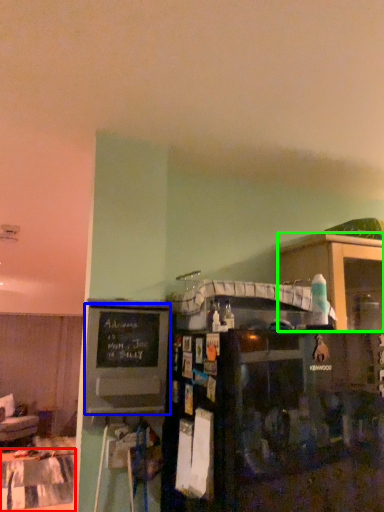
Question: Considering the real-world distances, which object is closest to table (highlighted by a red box)? bulletin board (highlighted by a blue box) or shelf (highlighted by a green box).

Choices:
 (A) bulletin board
 (B) shelf

Answer: (A)